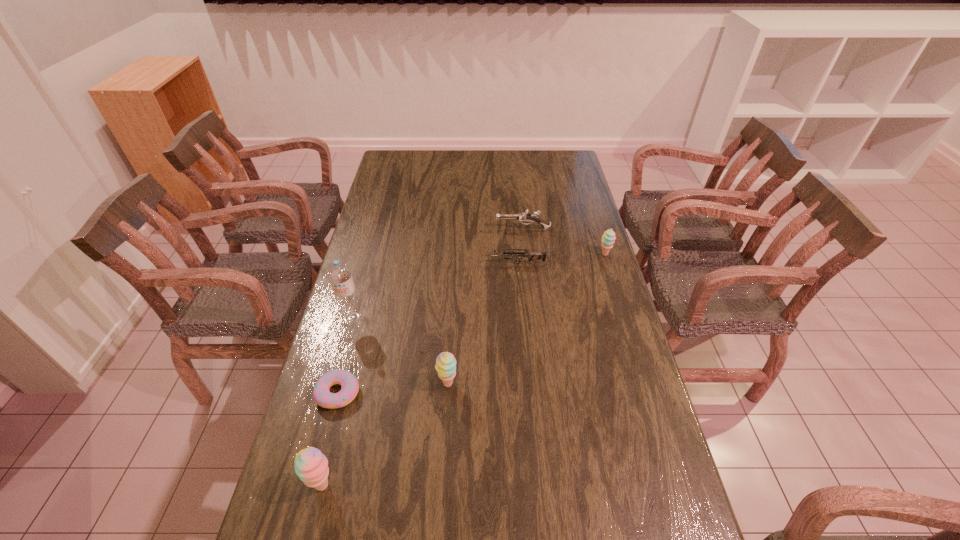
Image resolution: width=960 pixels, height=540 pixels. I want to click on empty location between the second sherbert from left to right and the taller gun, so click(x=486, y=306).

Locate an element on the screen. This screenshot has height=540, width=960. vacant space that's between the shortest object and the nearest sherbert is located at coordinates (331, 438).

In order to click on vacant area that lies between the fourth farthest object and the sixth tallest object in this screenshot , I will do `click(434, 291)`.

This screenshot has width=960, height=540. In order to click on object that is the third closest to the shorter gun in this screenshot , I will do `click(339, 274)`.

Where is `the sixth closest object relative to the taller gun`? Image resolution: width=960 pixels, height=540 pixels. the sixth closest object relative to the taller gun is located at coordinates (311, 465).

You are a GUI agent. You are given a task and a screenshot of the screen. Output one action in this format:
    pyautogui.click(x=<x>, y=<y>)
    Task: Click on the sherbert that is the second closest to the fourth tallest object
    
    Given the screenshot: What is the action you would take?
    pyautogui.click(x=311, y=465)

This screenshot has width=960, height=540. Identify the location of sherbert that stands as the closest to the second shortest object. (608, 237).

Image resolution: width=960 pixels, height=540 pixels. What are the coordinates of `vacant point that satisfies the following two spatial constraints: 1. aimed along the barrel of the farther gun; 2. on the front side of the nearest sherbert` in the screenshot? It's located at (552, 485).

The height and width of the screenshot is (540, 960). Identify the location of free space that satisfies the following two spatial constraints: 1. aimed along the barrel of the shorter gun; 2. on the front side of the tallest object. (520, 318).

This screenshot has height=540, width=960. Find the location of `free space in the image that satisfies the following two spatial constraints: 1. aimed along the barrel of the third farthest object; 2. on the front side of the tallest object`. free space in the image that satisfies the following two spatial constraints: 1. aimed along the barrel of the third farthest object; 2. on the front side of the tallest object is located at coordinates (520, 318).